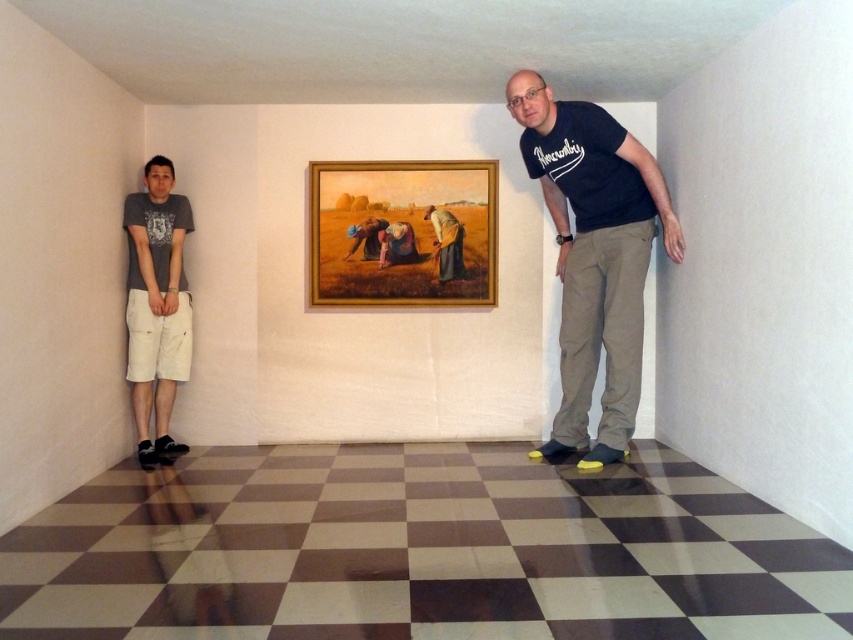
You are standing in the gallery and want to place a small sculpture between the wooden frame at center and the brown textured fabric at center. The sculpture is 10 inches wide. Can it fit in the space between them?

The wooden frame at center is 9.00 inches away from the brown textured fabric at center. Since the sculpture is 10 inches wide, it cannot fit in the space between them as the distance is smaller than the sculpture.

You are standing in the museum and want to take a photo of both point (x=457, y=193) and point (x=428, y=209) in the foreground. Since you can only focus on one point at a time, which point should you focus on to ensure the other remains in the background?

You should focus on point (x=428, y=209) because point (x=457, y=193) is behind it, so focusing on the closer point will keep the farther one in the background.